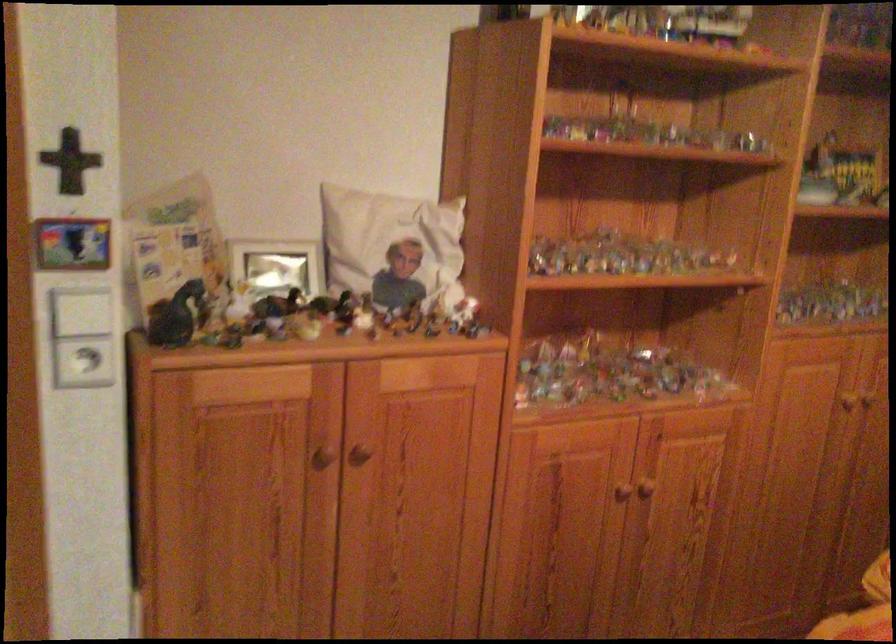
First-person continuous shooting, in which direction is the camera rotating?

The camera rotated toward left-down.